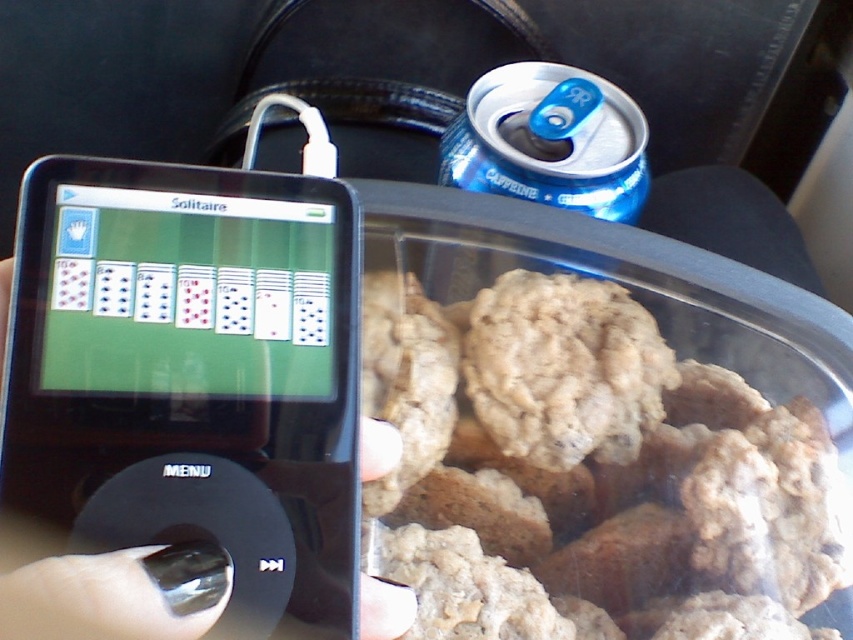
This screenshot has width=853, height=640. I want to click on baked oatmeal cookies at lower right, so click(x=589, y=472).

Is point (372, 356) in front of point (570, 122)?

That is True.

Where is `baked oatmeal cookies at lower right`? The height and width of the screenshot is (640, 853). baked oatmeal cookies at lower right is located at coordinates (589, 472).

Which is in front, point (573, 440) or point (351, 392)?

Point (351, 392) is in front.

Is baked oatmeal cookies at lower right closer to camera compared to black glossy ipod at left?

No, baked oatmeal cookies at lower right is behind black glossy ipod at left.

Is point (817, 483) positioned after point (170, 317)?

Yes, point (817, 483) is farther from viewer.

What are the coordinates of `baked oatmeal cookies at lower right` in the screenshot? It's located at (589, 472).

Who is more forward, (281, 308) or (577, 76)?

Point (281, 308) is in front.

Between point (260, 500) and point (639, 163), which one is positioned behind?

Point (639, 163)

Is point (305, 252) more distant than point (444, 148)?

No, it is in front of (444, 148).

The height and width of the screenshot is (640, 853). I want to click on black glossy ipod at left, so click(192, 374).